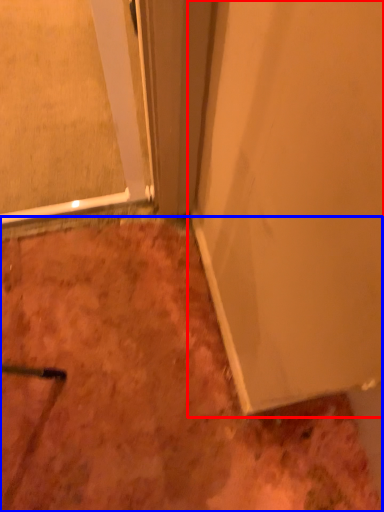
Question: Which point is closer to the camera, door (highlighted by a red box) or dirt (highlighted by a blue box)?

Choices:
 (A) door
 (B) dirt

Answer: (A)